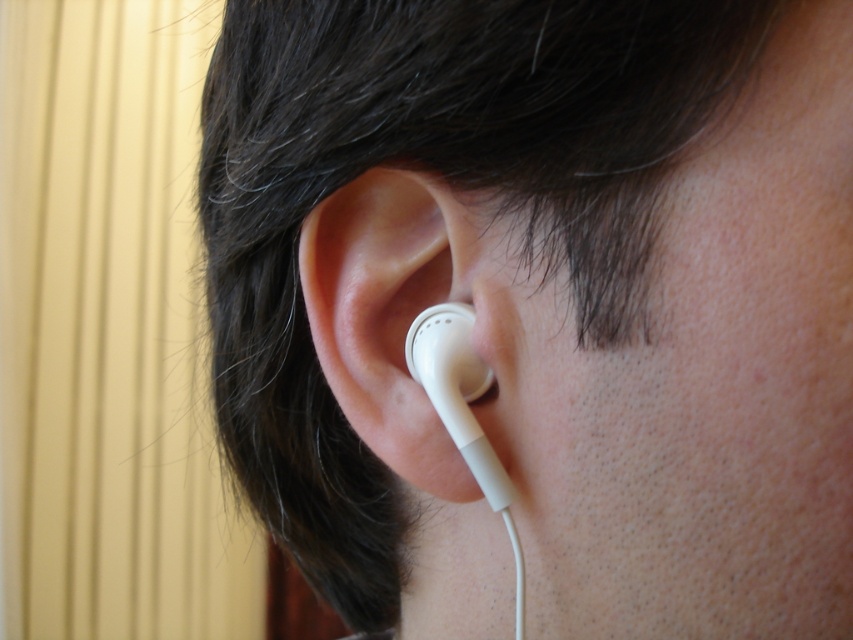
You are a photographer adjusting the focus on your camera. You notice two points in the image at coordinates point (x=428, y=180) and point (x=496, y=488). Which point should you focus on to ensure the earbud is in sharp focus?

Point (x=428, y=180) is closer to the viewer than point (x=496, y=488), so focusing on point (x=428, y=180) will ensure the earbud is in sharp focus.

You are a photographer adjusting the focus on your camera. You want to capture a clear image of the point at coordinates point (399,177). If your camera has a focal length of 50mm, what is the minimum distance in centimeters you should set the focus to ensure the point is sharp?

The point at coordinates point (399,177) is 35.39 centimeters from the viewer. Therefore, you should set the focus distance to at least 35.39 centimeters to ensure the point is in sharp focus.